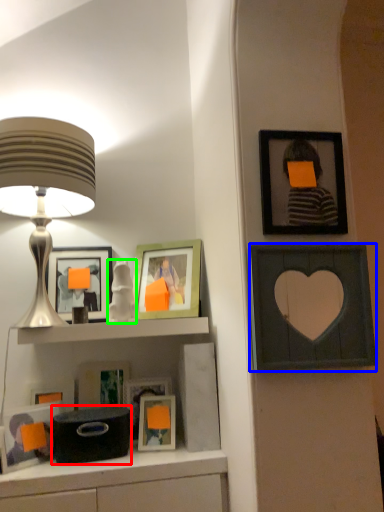
Question: Which object is positioned farthest from box (highlighted by a red box)? Select from picture frame (highlighted by a blue box) and toy (highlighted by a green box).

Choices:
 (A) picture frame
 (B) toy

Answer: (A)